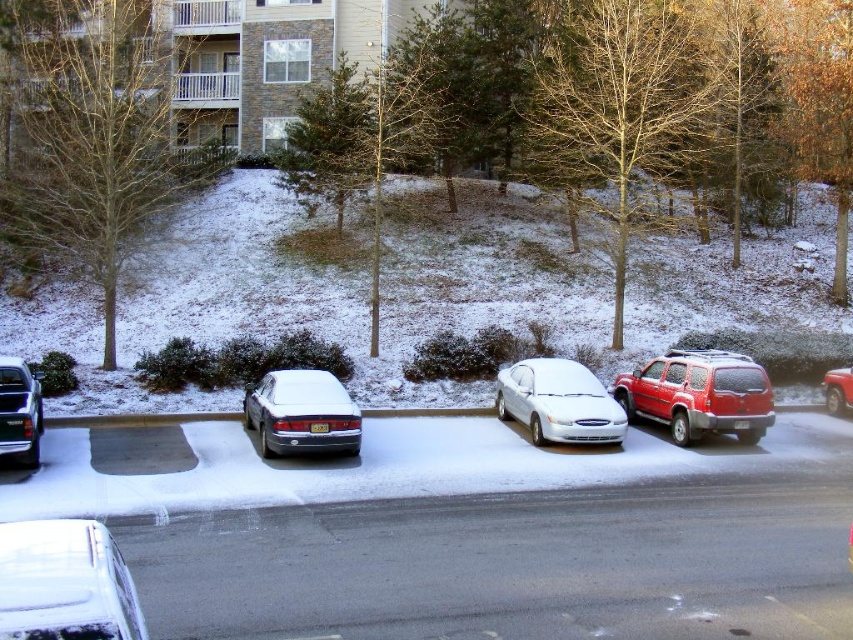
You are a delivery driver who needs to park your truck in this parking lot. You have a tall delivery van that is 2 meters in height. The white glossy sedan at center and the shiny red suv at right are already parked there. Which vehicle should you avoid parking next to if you want to ensure there is enough vertical clearance for your van?

The white glossy sedan at center is much taller than the shiny red suv at right. Therefore, you should avoid parking next to the white glossy sedan at center because its height may interfere with the vertical clearance needed for your tall delivery van.

You are standing in the snowy parking lot and want to reach a specific point marked at coordinates point [4,371]. If your walking speed is 3 feet per second, how many seconds will it take you to reach that point?

The distance of point [4,371] from viewer is 44.85 feet. At a speed of 3 feet per second, it will take 44.85 divided by 3, which is approximately 14.95 seconds. So, about 15 seconds.

You are a delivery driver who needs to park your truck in the parking lot shown. You have a large delivery truck that is 6 meters long. There is a space between the white glossy sedan at lower left and the sleek silver sedan at center. Can your truck fit in that space?

The white glossy sedan at lower left is smaller than the sleek silver sedan at center, but the space between them may vary based on their sizes. However, since the white glossy sedan is smaller, the space between them might be sufficient for a 6 meter truck. However, without exact measurements, it is uncertain. Please check the actual space available.